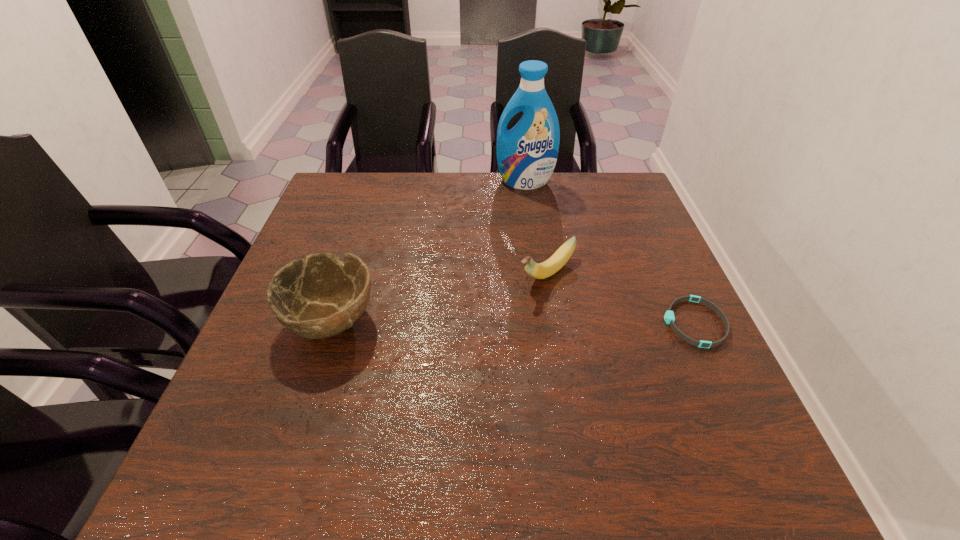
The image size is (960, 540). Find the location of `free area in between the wristband and the detergent`. free area in between the wristband and the detergent is located at coordinates (610, 252).

In order to click on vacant space that is in between the leftmost object and the tallest object in this screenshot , I will do `click(427, 251)`.

Find the location of `unoccupied position between the banana and the detergent`. unoccupied position between the banana and the detergent is located at coordinates (536, 227).

Locate an element on the screen. This screenshot has height=540, width=960. vacant space that is in between the banana and the wristband is located at coordinates (621, 298).

Where is `blank region between the leftmost object and the banana`? blank region between the leftmost object and the banana is located at coordinates (439, 297).

The width and height of the screenshot is (960, 540). Find the location of `object that ranks as the third closest to the farthest object`. object that ranks as the third closest to the farthest object is located at coordinates (319, 297).

Select which object is the closest to the detergent. Please provide its 2D coordinates. Your answer should be formatted as a tuple, i.e. [(x, y)], where the tuple contains the x and y coordinates of a point satisfying the conditions above.

[(543, 270)]

Locate an element on the screen. This screenshot has height=540, width=960. free location that satisfies the following two spatial constraints: 1. on the front side of the wristband; 2. on the buckle of the farthest object is located at coordinates (544, 323).

At what (x,y) coordinates should I click in order to perform the action: click on free space that satisfies the following two spatial constraints: 1. on the front side of the detergent; 2. on the buckle of the shortest object. Please return your answer as a coordinate pair (x, y). Image resolution: width=960 pixels, height=540 pixels. Looking at the image, I should click on (544, 323).

Where is `free location that satisfies the following two spatial constraints: 1. on the front side of the banana; 2. on the buckle of the shortest object`? free location that satisfies the following two spatial constraints: 1. on the front side of the banana; 2. on the buckle of the shortest object is located at coordinates (556, 323).